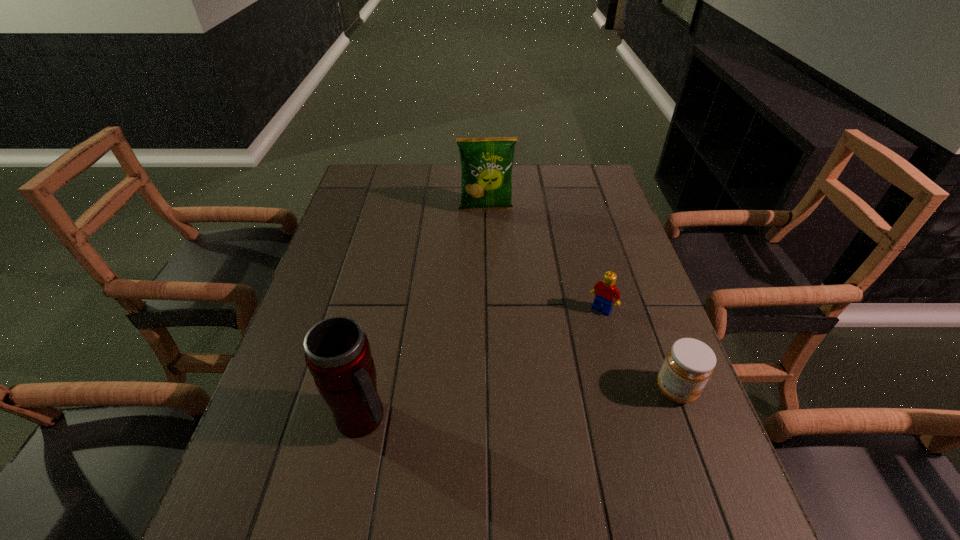
Identify the location of free location located on the front-facing side of the crisp (potato chip). (490, 227).

Image resolution: width=960 pixels, height=540 pixels. Identify the location of vacant space located 0.080m on the front-facing side of the crisp (potato chip). (490, 231).

Where is `free region located on the front-facing side of the crisp (potato chip)`? free region located on the front-facing side of the crisp (potato chip) is located at coordinates (491, 233).

Image resolution: width=960 pixels, height=540 pixels. In order to click on object situated at the near edge in this screenshot , I will do `click(337, 352)`.

Where is `object located in the left edge section of the desktop`? This screenshot has height=540, width=960. object located in the left edge section of the desktop is located at coordinates (337, 352).

This screenshot has height=540, width=960. I want to click on jam that is at the right edge, so click(689, 363).

At what (x,y) coordinates should I click in order to perform the action: click on Lego that is positioned at the right edge. Please return your answer as a coordinate pair (x, y). Looking at the image, I should click on (606, 292).

Locate an element on the screen. The image size is (960, 540). object positioned at the near left corner is located at coordinates (337, 352).

I want to click on free space at the far edge of the desktop, so click(x=546, y=185).

At what (x,y) coordinates should I click in order to perform the action: click on free space at the near edge of the desktop. Please return your answer as a coordinate pair (x, y). Looking at the image, I should click on (558, 447).